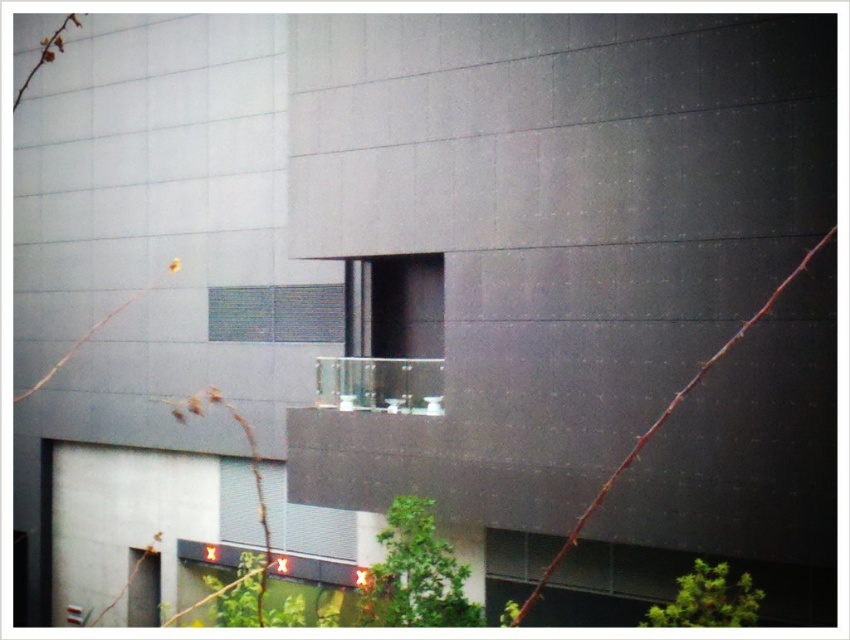
Question: Is clear glass window at lower center behind clear glass balcony at center?

Choices:
 (A) yes
 (B) no

Answer: (A)

Question: Which of these objects is positioned closest to the translucent glass window at center?

Choices:
 (A) transparent glass window at center
 (B) clear glass window at lower center
 (C) clear glass balcony at center

Answer: (A)

Question: Which is farther from the clear glass balcony at center?

Choices:
 (A) translucent glass window at center
 (B) transparent glass window at center
 (C) clear glass window at lower center

Answer: (C)

Question: Which of the following is the farthest from the observer?

Choices:
 (A) (352, 362)
 (B) (222, 305)
 (C) (228, 461)

Answer: (C)

Question: Can you confirm if clear glass window at lower center is positioned to the left of translucent glass window at center?

Choices:
 (A) yes
 (B) no

Answer: (B)

Question: Does transparent glass window at center have a greater width compared to translucent glass window at center?

Choices:
 (A) yes
 (B) no

Answer: (B)